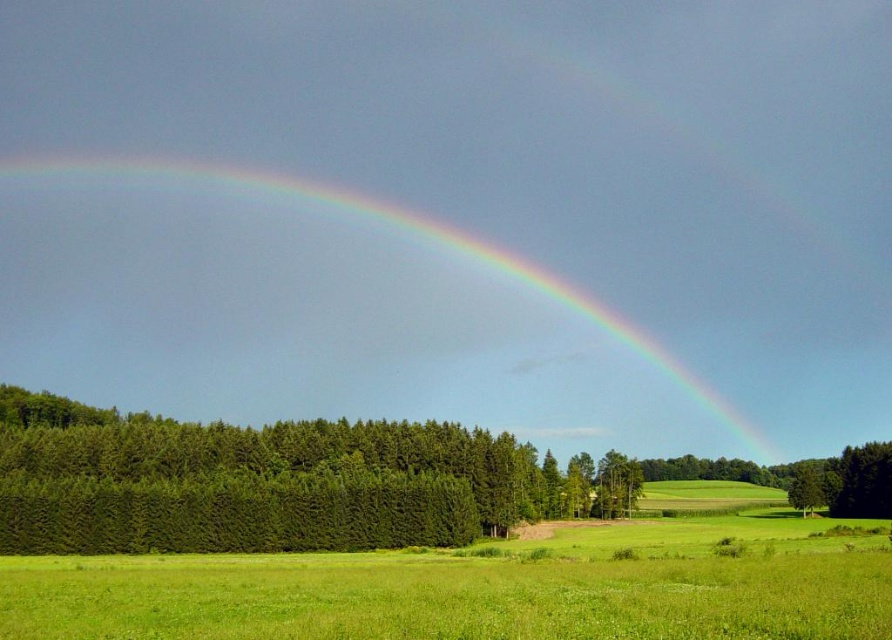
You are an artist trying to paint the scene. You need to decide which area to focus on first based on the size of the objects. Which object should you paint first, the green textured trees at left or the green leafy tree at center?

Result: The green textured trees at left might be wider than green leafy tree at center, so you should paint the green textured trees at left first to capture their broader presence in the composition.